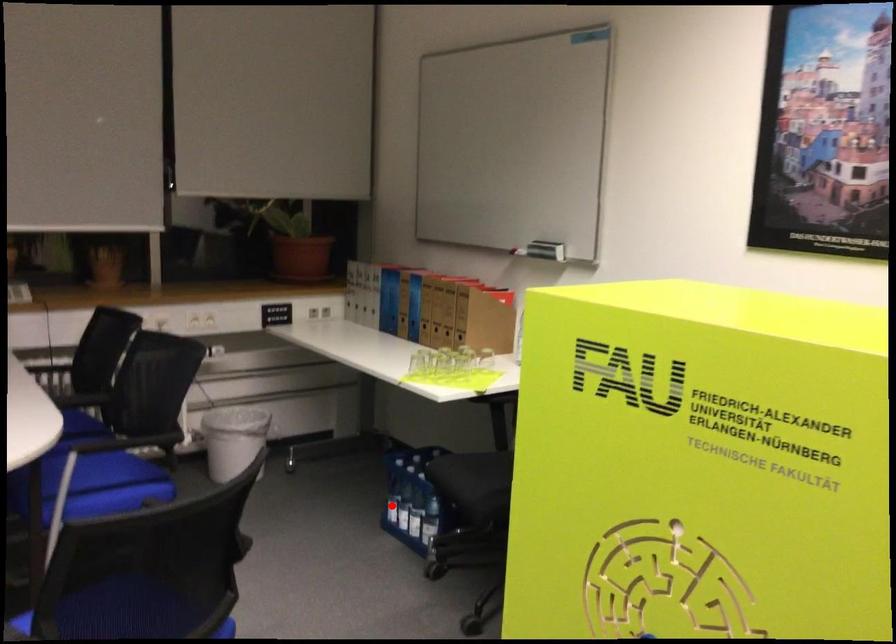
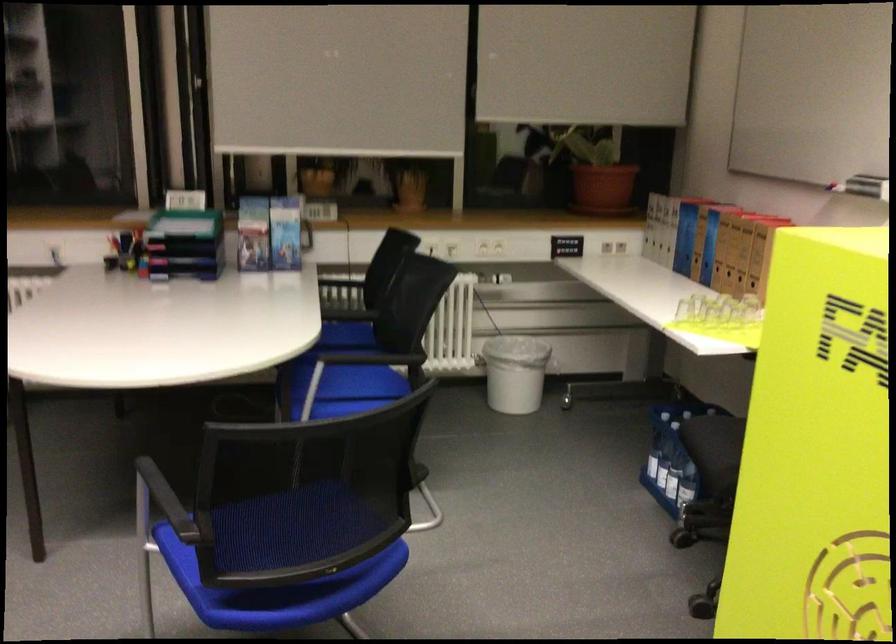
Where in the second image is the point corresponding to the highlighted location from the first image?

(650, 458)